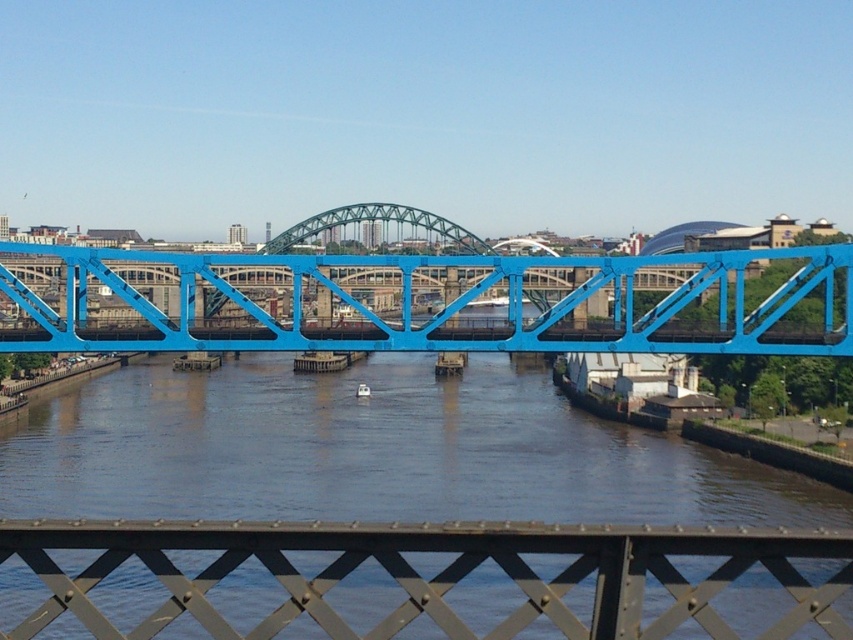
You are standing at the coordinates point 0.5, 0.5 in the image. Which object from the list is closest to your current position? The objects are blue metallic bridge at center.

The blue metallic bridge at center is located at point (440, 308), so it is the closest object to your current position at (426, 320).

You are a photographer planning to capture the blue metallic bridge at center and the brown matte water at center in a single shot. Based on their heights, which object will appear larger in the photograph?

The brown matte water at center has a greater height compared to the blue metallic bridge at center, so it will appear larger in the photograph.